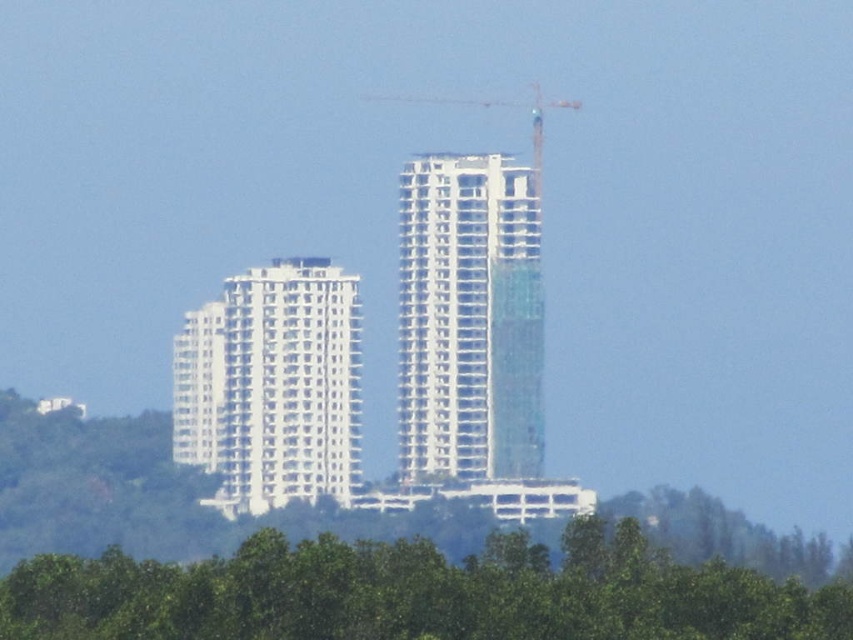
You are standing in front of the two buildings and want to take a photo of the green leafy trees at lower center. What are the coordinates of the trees in the image?

The 2D coordinates of the green leafy trees at lower center are at point (416, 593).

You are a construction worker standing at the green leafy trees at lower center. You need to look up to see the white metallic crane at center. Is the crane above or below you?

The green leafy trees at lower center is located below white metallic crane at center, so the crane is above you.